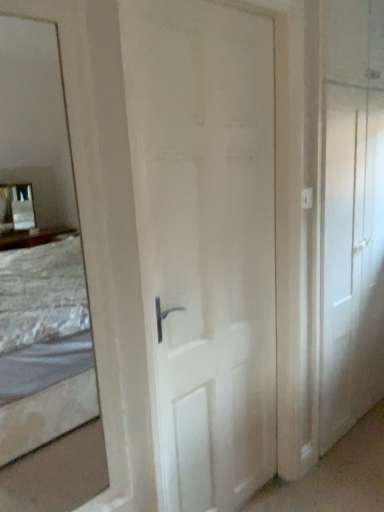
Question: From the image's perspective, is white matte door at center, which appears as the second door when viewed from the right, on white matte door at right, the second door viewed from the left?

Choices:
 (A) no
 (B) yes

Answer: (A)

Question: From a real-world perspective, does white matte door at center, which is the 1th door in left-to-right order, sit lower than white matte door at right, marked as the 1th door in a right-to-left arrangement?

Choices:
 (A) yes
 (B) no

Answer: (A)

Question: Can you confirm if white matte door at center, which is the 1th door in left-to-right order, is bigger than white matte door at right, the second door viewed from the left?

Choices:
 (A) yes
 (B) no

Answer: (B)

Question: Does white matte door at center, which appears as the second door when viewed from the right, have a greater height compared to white matte door at right, marked as the 1th door in a right-to-left arrangement?

Choices:
 (A) no
 (B) yes

Answer: (A)

Question: Does white matte door at center, which appears as the second door when viewed from the right, have a lesser height compared to white matte door at right, the second door viewed from the left?

Choices:
 (A) yes
 (B) no

Answer: (A)

Question: Does white matte door at center, which appears as the second door when viewed from the right, appear on the right side of white matte door at right, the second door viewed from the left?

Choices:
 (A) yes
 (B) no

Answer: (B)

Question: Are white matte door at right, the second door viewed from the left, and white matte door at center, which is the 1th door in left-to-right order, making contact?

Choices:
 (A) yes
 (B) no

Answer: (B)

Question: Is the position of white matte door at right, marked as the 1th door in a right-to-left arrangement, less distant than that of white matte door at center, which is the 1th door in left-to-right order?

Choices:
 (A) no
 (B) yes

Answer: (A)

Question: Considering the relative sizes of white matte door at right, marked as the 1th door in a right-to-left arrangement, and white matte door at center, which is the 1th door in left-to-right order, in the image provided, is white matte door at right, marked as the 1th door in a right-to-left arrangement, thinner than white matte door at center, which is the 1th door in left-to-right order,?

Choices:
 (A) no
 (B) yes

Answer: (B)

Question: Is white matte door at right, the second door viewed from the left, surrounding white matte door at center, which is the 1th door in left-to-right order?

Choices:
 (A) yes
 (B) no

Answer: (B)

Question: Is white matte door at right, marked as the 1th door in a right-to-left arrangement, bigger than white matte door at center, which appears as the second door when viewed from the right?

Choices:
 (A) no
 (B) yes

Answer: (B)

Question: Does white matte door at right, the second door viewed from the left, turn towards white matte door at center, which appears as the second door when viewed from the right?

Choices:
 (A) no
 (B) yes

Answer: (A)

Question: In the image, is white matte door at right, marked as the 1th door in a right-to-left arrangement, positioned in front of or behind white matte door at center, which appears as the second door when viewed from the right?

Choices:
 (A) front
 (B) behind

Answer: (B)